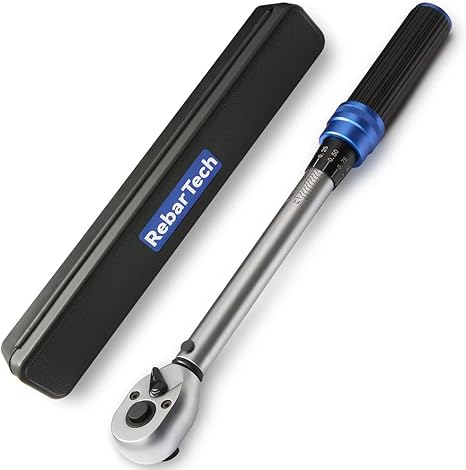
Find the location of a particular element. The image size is (466, 470). handle is located at coordinates (394, 55).